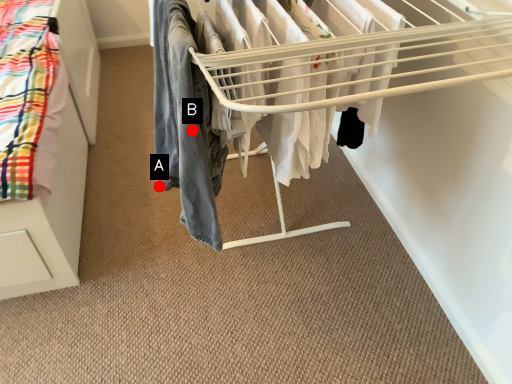
Question: Two points are circled on the image, labeled by A and B beside each circle. Which of the following is the farthest from the observer?

Choices:
 (A) A is further
 (B) B is further

Answer: (A)